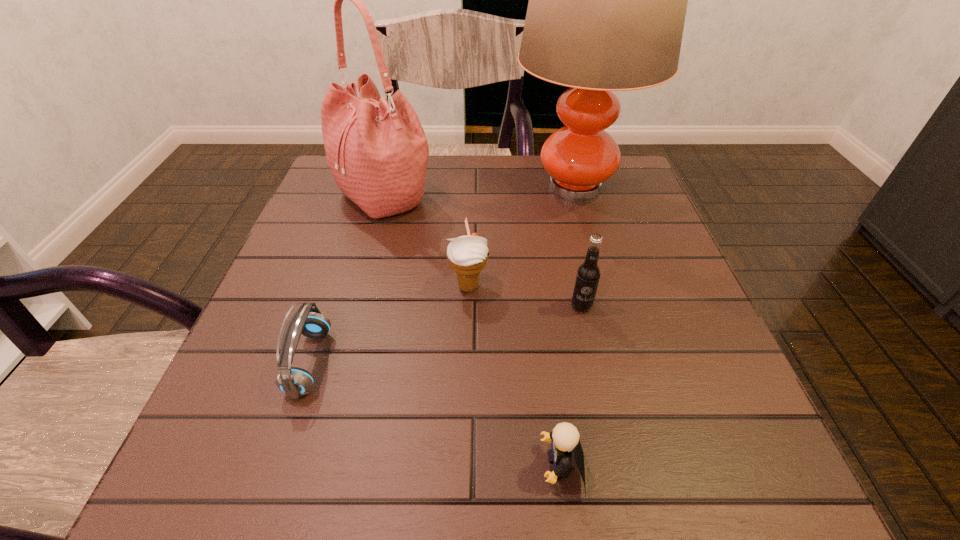
Where is `object at the right edge`? object at the right edge is located at coordinates (607, 4).

This screenshot has height=540, width=960. Find the location of `object that is positioned at the far left corner`. object that is positioned at the far left corner is located at coordinates (377, 152).

What are the coordinates of `object that is positioned at the far right corner` in the screenshot? It's located at (607, 4).

What are the coordinates of `vacant space at the far edge of the desktop` in the screenshot? It's located at (516, 166).

At what (x,y) coordinates should I click in order to perform the action: click on vacant space at the near edge of the desktop. Please return your answer as a coordinate pair (x, y). This screenshot has height=540, width=960. Looking at the image, I should click on (455, 488).

In the image, there is a desktop. Where is `vacant space at the left edge`? vacant space at the left edge is located at coordinates (235, 414).

At what (x,y) coordinates should I click in order to perform the action: click on free point at the right edge. Please return your answer as a coordinate pair (x, y). Image resolution: width=960 pixels, height=540 pixels. Looking at the image, I should click on (660, 406).

Where is `free space at the far left corner`? The height and width of the screenshot is (540, 960). free space at the far left corner is located at coordinates (330, 191).

At what (x,y) coordinates should I click in order to perform the action: click on vacant region at the near left corner of the desktop. Please return your answer as a coordinate pair (x, y). This screenshot has width=960, height=540. Looking at the image, I should click on (204, 444).

Find the location of a particular element. free space between the lamp and the fifth shortest object is located at coordinates (480, 191).